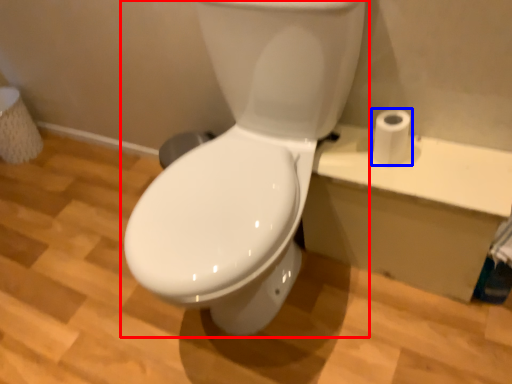
Question: Which point is further to the camera, toilet (highlighted by a red box) or toilet paper (highlighted by a blue box)?

Choices:
 (A) toilet
 (B) toilet paper

Answer: (B)